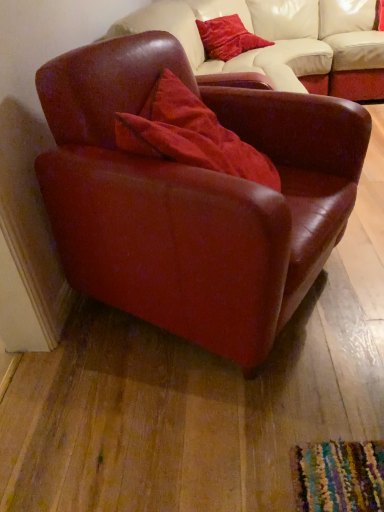
The height and width of the screenshot is (512, 384). In order to click on velvet red pillow at center, placed as the first pillow when sorted from front to back in this screenshot , I will do `click(190, 135)`.

Describe the element at coordinates (190, 135) in the screenshot. The height and width of the screenshot is (512, 384). I see `velvet red pillow at center, placed as the first pillow when sorted from front to back` at that location.

This screenshot has width=384, height=512. Describe the element at coordinates (228, 38) in the screenshot. I see `velvet red pillow at upper center, which is counted as the first pillow, starting from the top` at that location.

Where is `matte leather armchair at center`? This screenshot has height=512, width=384. matte leather armchair at center is located at coordinates (194, 198).

Which object is further away from the camera taking this photo, velvet red pillow at upper center, which is counted as the first pillow, starting from the top, or velvet red pillow at center, the 1th pillow when ordered from bottom to top?

velvet red pillow at upper center, which is counted as the first pillow, starting from the top, is further away from the camera.

From a real-world perspective, is velvet red pillow at upper center, the first pillow positioned from the back, positioned above or below velvet red pillow at center, placed as the first pillow when sorted from front to back?

velvet red pillow at upper center, the first pillow positioned from the back, is below velvet red pillow at center, placed as the first pillow when sorted from front to back.

Looking at this image, what's the angular difference between velvet red pillow at upper center, marked as the 2th pillow in a front-to-back arrangement, and velvet red pillow at center, placed as the first pillow when sorted from front to back,'s facing directions?

36.9 degrees separate the facing orientations of velvet red pillow at upper center, marked as the 2th pillow in a front-to-back arrangement, and velvet red pillow at center, placed as the first pillow when sorted from front to back.

Is velvet red pillow at upper center, which is counted as the first pillow, starting from the top, thinner than velvet red pillow at center, which ranks as the second pillow in back-to-front order?

Correct, the width of velvet red pillow at upper center, which is counted as the first pillow, starting from the top, is less than that of velvet red pillow at center, which ranks as the second pillow in back-to-front order.

Is matte leather armchair at center positioned with its back to velvet red pillow at upper center, the second pillow when ordered from bottom to top?

That's not correct — matte leather armchair at center is not looking away from velvet red pillow at upper center, the second pillow when ordered from bottom to top.

Considering their positions, is matte leather armchair at center located in front of or behind velvet red pillow at upper center, marked as the 2th pillow in a front-to-back arrangement?

In the image, matte leather armchair at center appears in front of velvet red pillow at upper center, marked as the 2th pillow in a front-to-back arrangement.

This screenshot has height=512, width=384. Identify the location of the 2nd pillow behind the matte leather armchair at center. (228, 38).

Considering the relative positions of matte leather armchair at center and velvet red pillow at upper center, the first pillow positioned from the back, in the image provided, is matte leather armchair at center to the left of velvet red pillow at upper center, the first pillow positioned from the back, from the viewer's perspective?

Yes.

Does velvet red pillow at center, the 2th pillow when ordered from top to bottom, come in front of matte leather armchair at center?

No.

From a real-world perspective, is velvet red pillow at center, which ranks as the second pillow in back-to-front order, positioned under matte leather armchair at center based on gravity?

Incorrect, from a real-world perspective, velvet red pillow at center, which ranks as the second pillow in back-to-front order, is higher than matte leather armchair at center.

Between velvet red pillow at center, which ranks as the second pillow in back-to-front order, and matte leather armchair at center, which one appears on the right side from the viewer's perspective?

matte leather armchair at center.

Does point (195, 99) come farther from viewer compared to point (343, 150)?

Yes.

How distant is matte leather armchair at center from velvet red pillow at center, the 1th pillow when ordered from bottom to top?

matte leather armchair at center and velvet red pillow at center, the 1th pillow when ordered from bottom to top, are 20.60 centimeters apart from each other.

Is matte leather armchair at center next to velvet red pillow at center, placed as the first pillow when sorted from front to back?

No, matte leather armchair at center is not next to velvet red pillow at center, placed as the first pillow when sorted from front to back.

Is matte leather armchair at center turned away from velvet red pillow at center, the 2th pillow when ordered from top to bottom?

Yes, velvet red pillow at center, the 2th pillow when ordered from top to bottom, is at the back of matte leather armchair at center.

Is matte leather armchair at center located outside velvet red pillow at center, which ranks as the second pillow in back-to-front order?

That's correct, matte leather armchair at center is outside of velvet red pillow at center, which ranks as the second pillow in back-to-front order.

Is velvet red pillow at center, the 2th pillow when ordered from top to bottom, touching velvet red pillow at upper center, marked as the 2th pillow in a front-to-back arrangement?

There is a gap between velvet red pillow at center, the 2th pillow when ordered from top to bottom, and velvet red pillow at upper center, marked as the 2th pillow in a front-to-back arrangement.

Which of these two, velvet red pillow at center, which ranks as the second pillow in back-to-front order, or velvet red pillow at upper center, which is counted as the first pillow, starting from the top, is wider?

Wider between the two is velvet red pillow at center, which ranks as the second pillow in back-to-front order.

Which object is more forward, velvet red pillow at center, the 2th pillow when ordered from top to bottom, or velvet red pillow at upper center, the first pillow positioned from the back?

velvet red pillow at center, the 2th pillow when ordered from top to bottom, is more forward.

Where is `pillow in front of the velvet red pillow at upper center, the second pillow when ordered from bottom to top`? This screenshot has height=512, width=384. pillow in front of the velvet red pillow at upper center, the second pillow when ordered from bottom to top is located at coordinates (190, 135).

From a real-world perspective, which object stands above the other?

velvet red pillow at upper center, the second pillow when ordered from bottom to top, is physically above.

Between velvet red pillow at upper center, marked as the 2th pillow in a front-to-back arrangement, and matte leather armchair at center, which one is positioned in front?

Positioned in front is matte leather armchair at center.

Who is shorter, velvet red pillow at upper center, marked as the 2th pillow in a front-to-back arrangement, or matte leather armchair at center?

With less height is velvet red pillow at upper center, marked as the 2th pillow in a front-to-back arrangement.

In the scene shown: Measure the distance from velvet red pillow at upper center, the first pillow positioned from the back, to matte leather armchair at center.

They are 1.94 meters apart.

Locate an element on the screen. pillow on the left of velvet red pillow at upper center, the second pillow when ordered from bottom to top is located at coordinates (190, 135).

This screenshot has height=512, width=384. I want to click on chair in front of the velvet red pillow at upper center, the first pillow positioned from the back, so click(x=194, y=198).

Estimate the real-world distances between objects in this image. Which object is closer to matte leather armchair at center, velvet red pillow at center, the 1th pillow when ordered from bottom to top, or velvet red pillow at upper center, which is counted as the first pillow, starting from the top?

velvet red pillow at center, the 1th pillow when ordered from bottom to top, is positioned closer to the anchor matte leather armchair at center.

In the scene shown: Looking at the image, which one is located further to velvet red pillow at center, the 2th pillow when ordered from top to bottom, matte leather armchair at center or velvet red pillow at upper center, marked as the 2th pillow in a front-to-back arrangement?

Among the two, velvet red pillow at upper center, marked as the 2th pillow in a front-to-back arrangement, is located further to velvet red pillow at center, the 2th pillow when ordered from top to bottom.

Looking at the image, which one is located further to velvet red pillow at upper center, the first pillow positioned from the back, velvet red pillow at center, the 1th pillow when ordered from bottom to top, or matte leather armchair at center?

Among the two, matte leather armchair at center is located further to velvet red pillow at upper center, the first pillow positioned from the back.

Based on their spatial positions, is velvet red pillow at upper center, the first pillow positioned from the back, or matte leather armchair at center further from velvet red pillow at center, placed as the first pillow when sorted from front to back?

The object further to velvet red pillow at center, placed as the first pillow when sorted from front to back, is velvet red pillow at upper center, the first pillow positioned from the back.

Based on their spatial positions, is velvet red pillow at upper center, the second pillow when ordered from bottom to top, or velvet red pillow at center, which ranks as the second pillow in back-to-front order, further from matte leather armchair at center?

The object further to matte leather armchair at center is velvet red pillow at upper center, the second pillow when ordered from bottom to top.

Estimate the real-world distances between objects in this image. Which object is further from velvet red pillow at upper center, the second pillow when ordered from bottom to top, matte leather armchair at center or velvet red pillow at center, placed as the first pillow when sorted from front to back?

The object further to velvet red pillow at upper center, the second pillow when ordered from bottom to top, is matte leather armchair at center.

Find the location of a particular element. pillow positioned between matte leather armchair at center and velvet red pillow at upper center, which is counted as the first pillow, starting from the top, from near to far is located at coordinates (x=190, y=135).